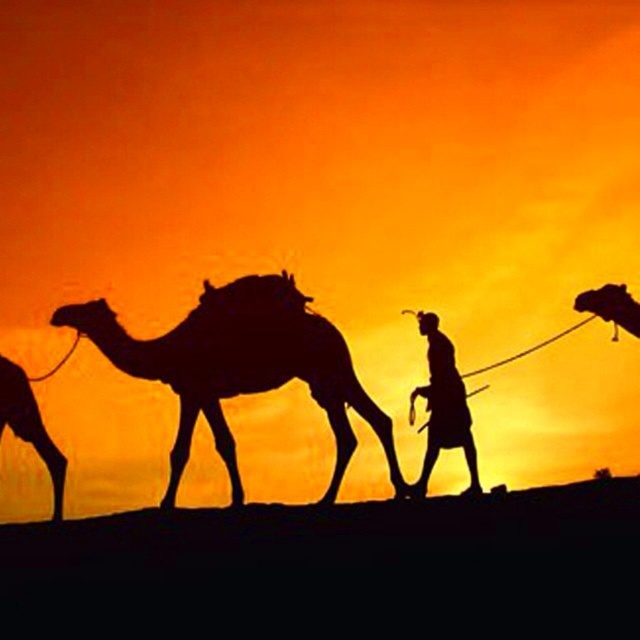
You are an observer standing in the desert watching the sunset. You see a silhouette figure at center and a silhouette camel at right. Which one is closer to the left side of your view?

The silhouette figure at center is closer to the left side of your view because it is positioned to the left of the silhouette camel at right.